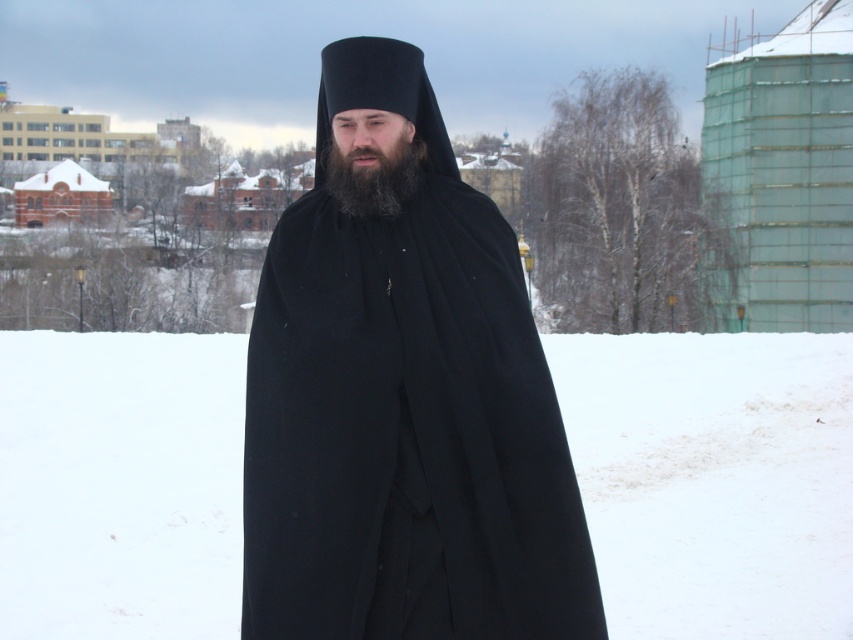
Question: Does white fluffy snow at center appear over black woolen robe at center?

Choices:
 (A) no
 (B) yes

Answer: (A)

Question: Observing the image, what is the correct spatial positioning of white fluffy snow at center in reference to black woolen robe at center?

Choices:
 (A) left
 (B) right

Answer: (A)

Question: Estimate the real-world distances between objects in this image. Which object is farther from the black woolen robe at center?

Choices:
 (A) black matte beard at center
 (B) white fluffy snow at center

Answer: (B)

Question: Which object appears closest to the camera in this image?

Choices:
 (A) white fluffy snow at center
 (B) black matte beard at center

Answer: (B)

Question: Which object is closer to the camera taking this photo?

Choices:
 (A) white fluffy snow at center
 (B) black matte beard at center

Answer: (B)

Question: Is black woolen robe at center to the right of black matte beard at center from the viewer's perspective?

Choices:
 (A) yes
 (B) no

Answer: (A)